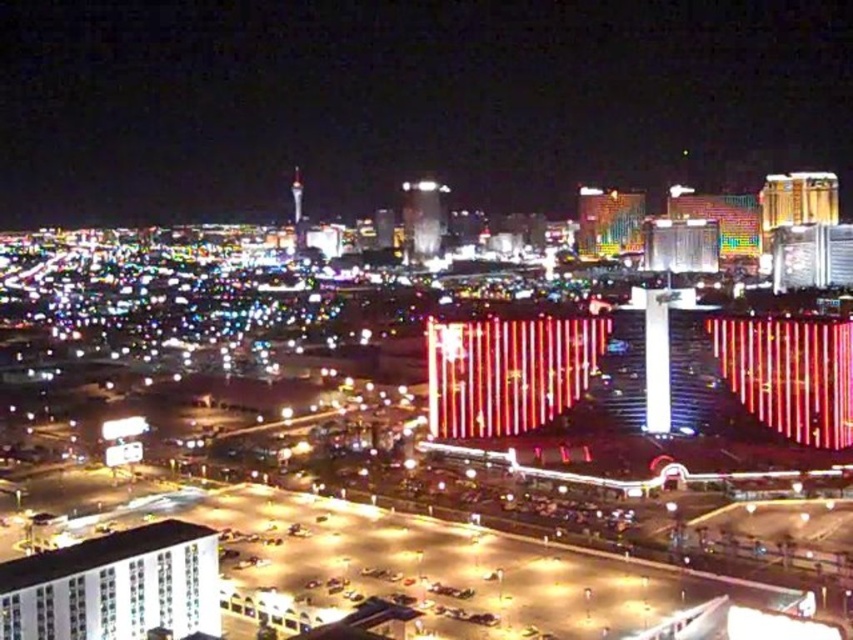
Is glittering neon lights at center to the right of white glossy building at lower left from the viewer's perspective?

Correct, you'll find glittering neon lights at center to the right of white glossy building at lower left.

Between point (140, 109) and point (198, 570), which one is positioned in front?

Point (198, 570) is more forward.

Locate an element on the screen. The width and height of the screenshot is (853, 640). glittering neon lights at center is located at coordinates (407, 100).